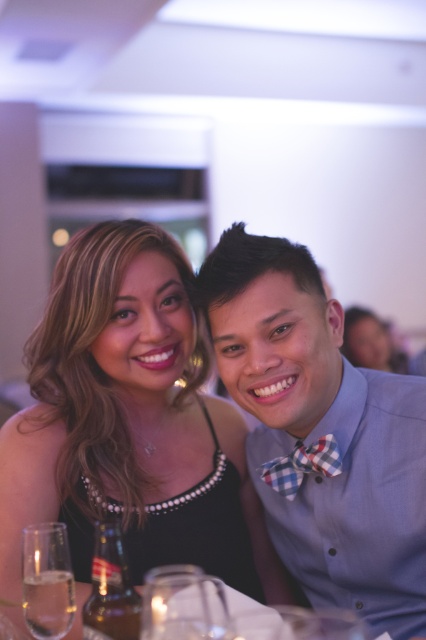
Question: Considering the relative positions of clear glass wine glass at lower center and checkered fabric bow tie at center in the image provided, where is clear glass wine glass at lower center located with respect to checkered fabric bow tie at center?

Choices:
 (A) left
 (B) right

Answer: (A)

Question: Estimate the real-world distances between objects in this image. Which object is farther from the checkered fabric bow tie at center?

Choices:
 (A) pearl necklace at center
 (B) clear glass wine glass at lower left
 (C) blue checkered bow tie at right

Answer: (B)

Question: Which object is farther from the camera taking this photo?

Choices:
 (A) clear glass wine glass at lower left
 (B) blue checkered bow tie at right
 (C) clear glass wine glass at lower center

Answer: (B)

Question: Which object is closer to the camera taking this photo?

Choices:
 (A) pearl necklace at center
 (B) clear glass wine glass at lower left

Answer: (B)

Question: Does pearl necklace at center have a lesser width compared to blue checkered bow tie at right?

Choices:
 (A) yes
 (B) no

Answer: (B)

Question: Does clear glass wine glass at lower center appear over checkered fabric bow tie at center?

Choices:
 (A) yes
 (B) no

Answer: (B)